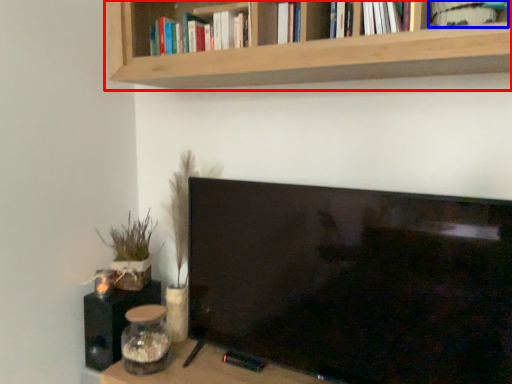
Question: Among these objects, which one is nearest to the camera, shelf (highlighted by a red box) or book (highlighted by a blue box)?

Choices:
 (A) shelf
 (B) book

Answer: (A)